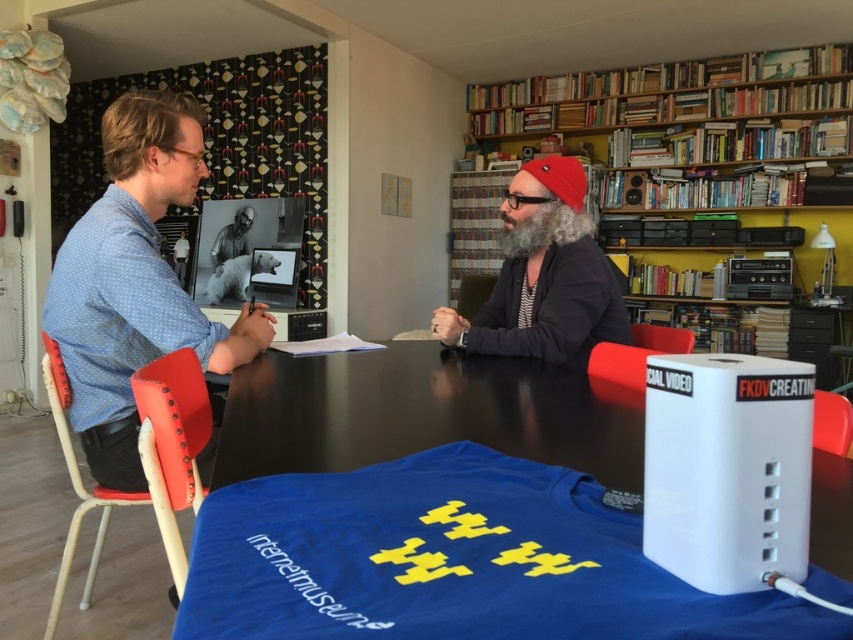
You are a guest at this event and need to place a small gift on the table without blocking the view of the text on the tablecloth. Considering the size of the black glossy table at center and the graywoollybeard at center, where should you place the gift?

The black glossy table at center is bigger than the graywoollybeard at center, so placing the gift on the black glossy table at center would ensure it doesn

You are a visitor at an event and want to place a small gift on the black glossy table at center without disturbing the graywoollybeard at center. Can you do this?

The black glossy table at center is not as tall as graywoollybeard at center, so the table is shorter. Since the table is lower, you can safely place the gift on it without disturbing the graywoollybeard at center.